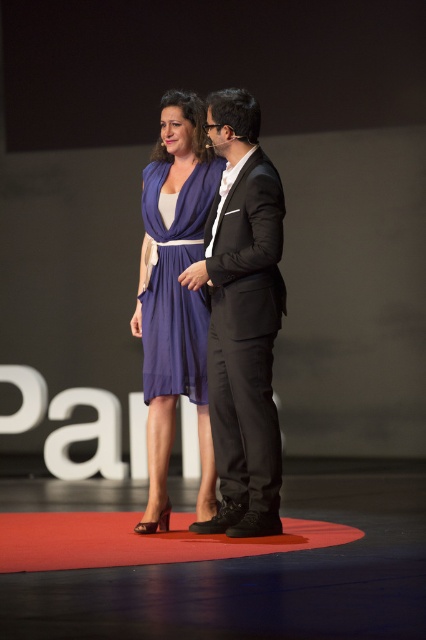
Does matte purple dress at center appear on the left side of red carpet at center?

In fact, matte purple dress at center is to the right of red carpet at center.

Does matte purple dress at center appear on the right side of red carpet at center?

Indeed, matte purple dress at center is positioned on the right side of red carpet at center.

Where is `matte purple dress at center`? This screenshot has width=426, height=640. matte purple dress at center is located at coordinates (175, 296).

Based on the photo, who is more distant from viewer, (270, 461) or (187, 380)?

Positioned behind is point (187, 380).

Where is `black satin suit at center`? The height and width of the screenshot is (640, 426). black satin suit at center is located at coordinates (242, 317).

Between point (236, 266) and point (144, 193), which one is positioned behind?

The point (144, 193) is behind.

At what (x,y) coordinates should I click in order to perform the action: click on black satin suit at center. Please return your answer as a coordinate pair (x, y). Looking at the image, I should click on (242, 317).

Can you confirm if black satin suit at center is thinner than red carpet at center?

Yes, black satin suit at center is thinner than red carpet at center.

This screenshot has width=426, height=640. Describe the element at coordinates (242, 317) in the screenshot. I see `black satin suit at center` at that location.

The width and height of the screenshot is (426, 640). In order to click on black satin suit at center in this screenshot , I will do `click(242, 317)`.